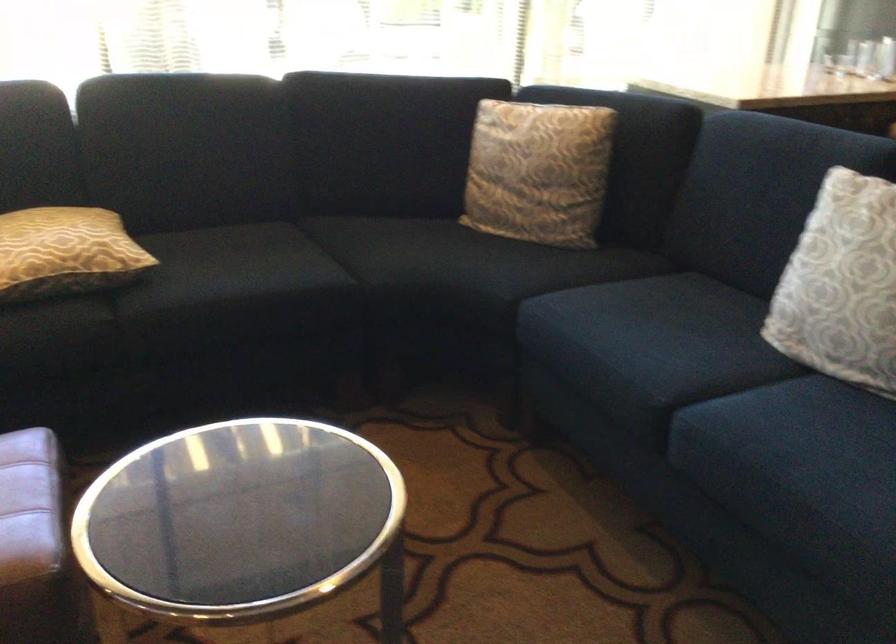
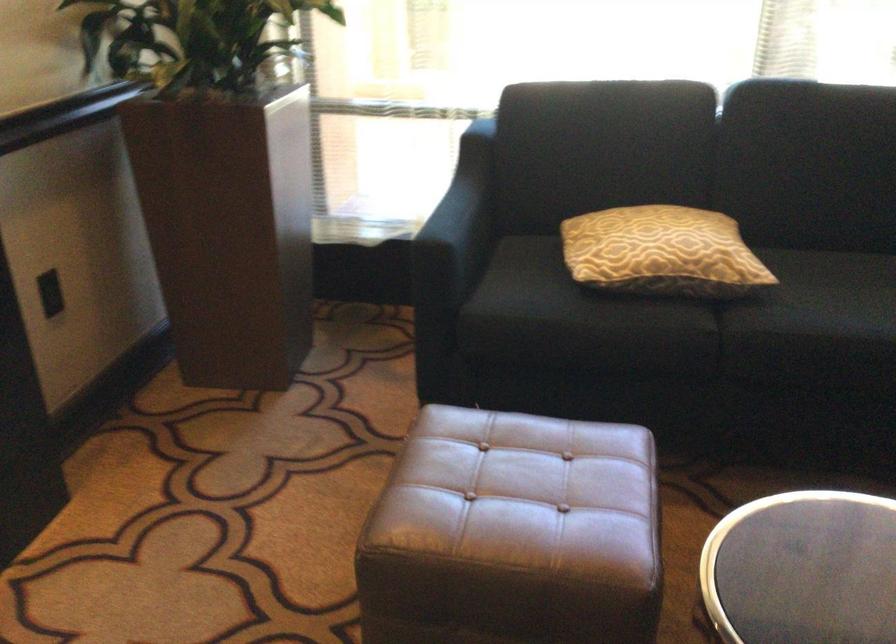
The point at (143, 272) is marked in the first image. Where is the corresponding point in the second image?

(752, 289)